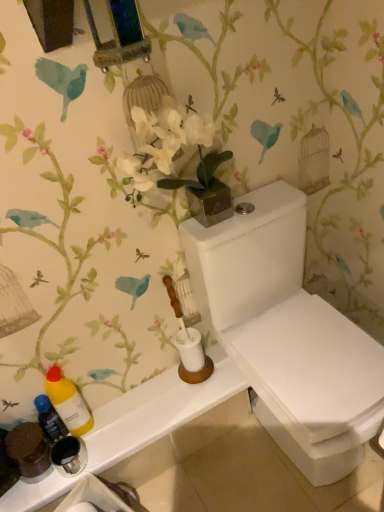
The image size is (384, 512). I want to click on vacant space that's between white ceramic toilet brush at center and yellow matte bottle at lower left, the 1th bottle from the right, so pyautogui.click(x=148, y=396).